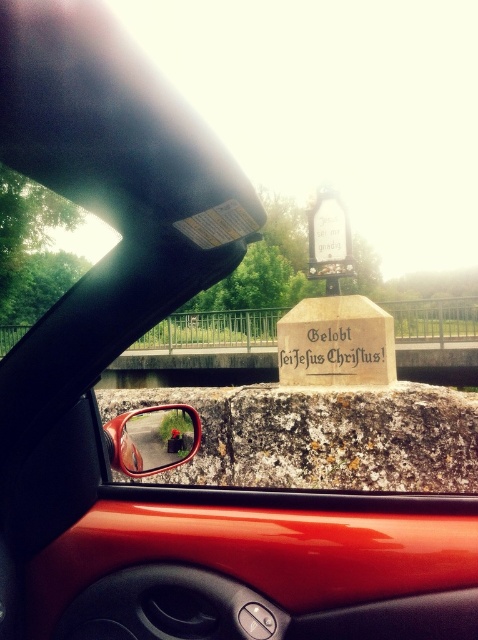
Can you confirm if gold metallic stone at center is bigger than glossy plastic rearview mirror at lower left?

Actually, gold metallic stone at center might be smaller than glossy plastic rearview mirror at lower left.

Does gold metallic stone at center appear on the right side of glossy plastic rearview mirror at lower left?

Indeed, gold metallic stone at center is positioned on the right side of glossy plastic rearview mirror at lower left.

Locate an element on the screen. This screenshot has width=478, height=640. gold metallic stone at center is located at coordinates (336, 348).